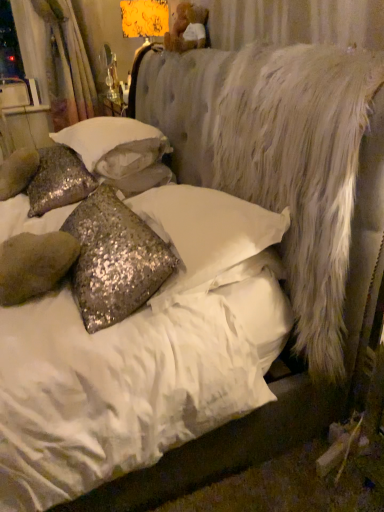
Question: From the image's perspective, is silver sequined pillow at center, the first pillow in the front-to-back sequence, above or below white sequined pillow at center, which is the second pillow in back-to-front order?

Choices:
 (A) above
 (B) below

Answer: (B)

Question: From a real-world perspective, is silver sequined pillow at center, arranged as the 3th pillow when viewed from the back, physically located above or below white sequined pillow at center, which is the second pillow in back-to-front order?

Choices:
 (A) below
 (B) above

Answer: (A)

Question: Which of these objects is positioned farthest from the white fluffy mattress at right?

Choices:
 (A) white textured curtain at upper left
 (B) silver sequined pillow at center, arranged as the 3th pillow when viewed from the back
 (C) white sequined pillow at center, positioned as the 2th pillow in front-to-back order
 (D) sparkly silver pillow at left, marked as the 1th pillow in a back-to-front arrangement

Answer: (A)

Question: Which is nearer to the white fluffy mattress at right?

Choices:
 (A) white textured curtain at upper left
 (B) silver sequined pillow at center, the first pillow in the front-to-back sequence
 (C) sparkly silver pillow at left, marked as the 1th pillow in a back-to-front arrangement
 (D) white sequined pillow at center, positioned as the 2th pillow in front-to-back order

Answer: (B)